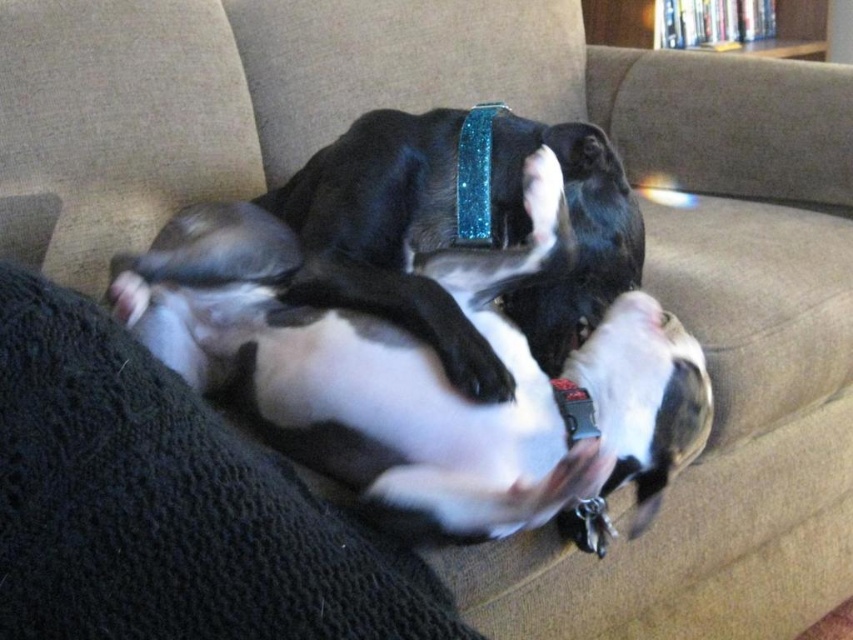
Between black knitted blanket at lower left and black shiny dog at center, which one has more height?

black shiny dog at center

What do you see at coordinates (167, 506) in the screenshot? The image size is (853, 640). I see `black knitted blanket at lower left` at bounding box center [167, 506].

Is point (64, 339) in front of point (485, 380)?

That is True.

Locate an element on the screen. This screenshot has width=853, height=640. black knitted blanket at lower left is located at coordinates (167, 506).

Which is behind, point (28, 588) or point (589, 419)?

The point (589, 419) is more distant.

Who is shorter, black knitted blanket at lower left or glittery blue neckband at center?

Standing shorter between the two is glittery blue neckband at center.

Is point (207, 636) farther from viewer compared to point (596, 429)?

No.

Locate an element on the screen. Image resolution: width=853 pixels, height=640 pixels. black knitted blanket at lower left is located at coordinates (167, 506).

Is black shiny dog at center positioned in front of glittery blue neckband at center?

No, black shiny dog at center is behind glittery blue neckband at center.

Who is more forward, (x=128, y=266) or (x=555, y=397)?

Point (x=555, y=397)

The width and height of the screenshot is (853, 640). What are the coordinates of `black shiny dog at center` in the screenshot? It's located at tap(454, 228).